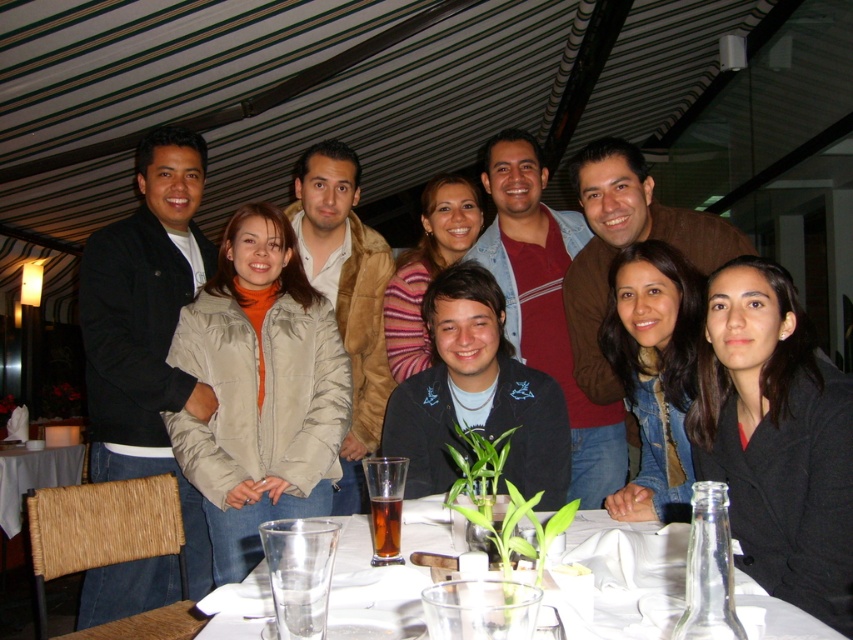
You are a photographer standing behind the group at the table. You want to place a small decorative item between the matte black jacket at left and the clear glass water at lower center. Is there enough space to fit the item, which is 2 feet wide?

The matte black jacket at left and clear glass water at lower center are 4.29 feet apart from each other, so yes, the 2 feet wide item can fit between them since the distance is greater than the item width.

You are a photographer standing at the center of the room. You want to take a photo of the clear glass water at lower center and the white fabric table at lower left. The camera you are using has a maximum focus range of 10 feet. Can you capture both objects in focus without moving the camera?

The clear glass water at lower center is 10.99 feet away from the white fabric table at lower left. Since the distance between them exceeds the camera maximum focus range of 10 feet, you cannot capture both objects in focus without moving the camera.

You are a photographer adjusting your camera settings to capture the group at the restaurant table. You need to ensure the matte black jacket at left is in focus. Where should you position your focus point based on its coordinates?

The matte black jacket at left is located at point (148, 328), so you should position your focus point there to ensure it is in focus.